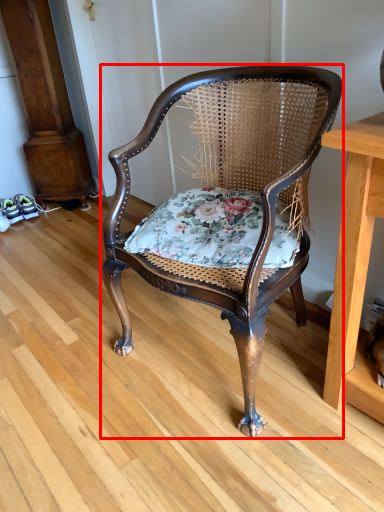
Question: Considering the relative positions of chair (annotated by the red box) and blanket in the image provided, where is chair (annotated by the red box) located with respect to the staircase?

Choices:
 (A) right
 (B) left

Answer: (A)